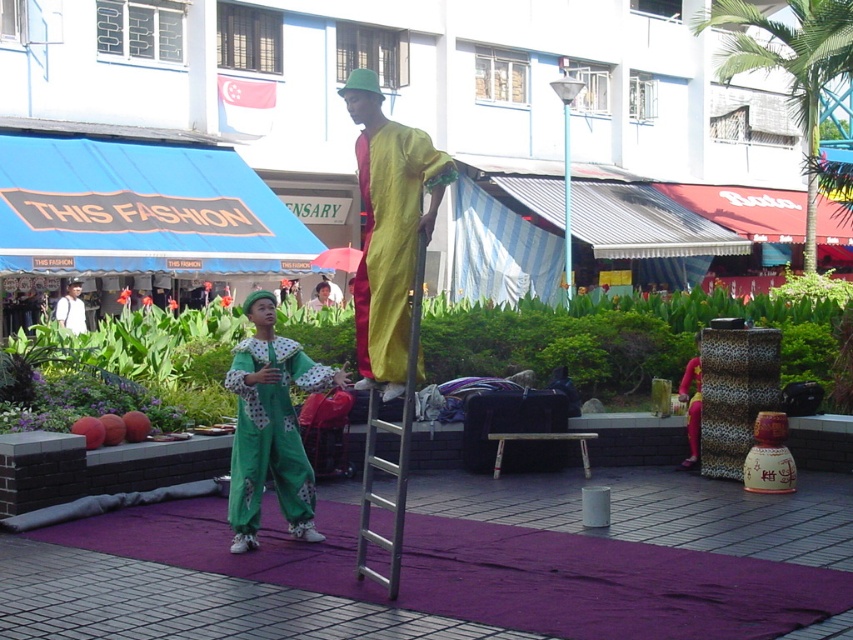
Is point (387, 540) closer to viewer compared to point (316, 307)?

Yes, it is.

Between point (389, 544) and point (321, 289), which one is positioned in front?

Point (389, 544) is in front.

The width and height of the screenshot is (853, 640). Find the location of `metallic silver ladder at center`. metallic silver ladder at center is located at coordinates (397, 452).

Is blue fabric canopy at upper left to the right of pink leopard print robe at center from the viewer's perspective?

Incorrect, blue fabric canopy at upper left is not on the right side of pink leopard print robe at center.

Which is in front, point (181, 179) or point (689, 416)?

Positioned in front is point (689, 416).

Locate an element on the screen. Image resolution: width=853 pixels, height=640 pixels. blue fabric canopy at upper left is located at coordinates (140, 209).

Does shiny yellow fabric at center appear on the right side of green fabric clown at center?

Correct, you'll find shiny yellow fabric at center to the right of green fabric clown at center.

Is point (393, 326) less distant than point (339, 291)?

Yes, it is.

Identify the location of shiny yellow fabric at center. (387, 227).